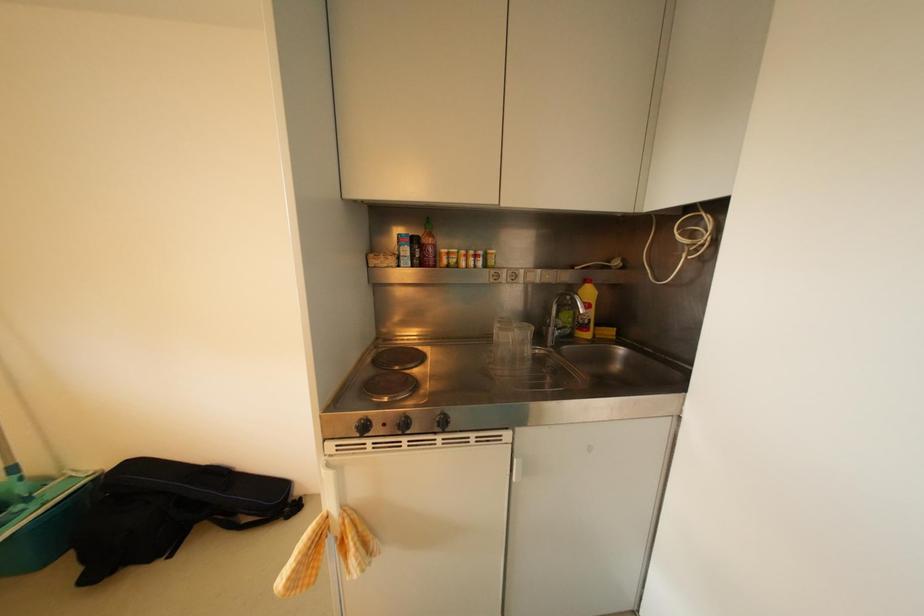
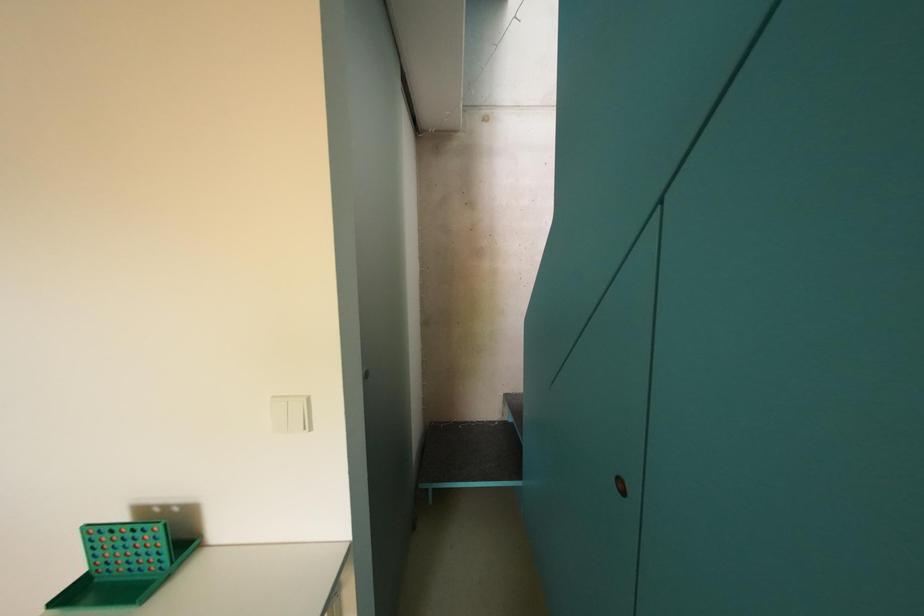
Question: Based on the continuous images, in which direction is the camera rotating? Reply with the corresponding letter.

Choices:
 (A) Left
 (B) Right
 (C) Up
 (D) Down

Answer: (B)